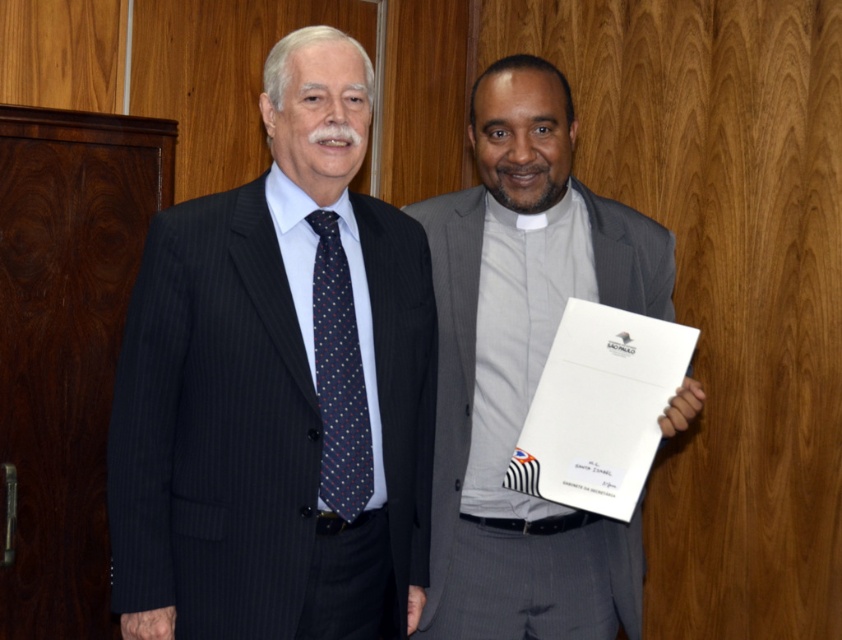
Question: From the image, what is the correct spatial relationship of gray matte suit at center in relation to dark blue silk tie at left?

Choices:
 (A) right
 (B) left

Answer: (A)

Question: Which object is positioned closest to the matte black suit at left?

Choices:
 (A) gray matte suit at center
 (B) dark blue silk tie at left

Answer: (B)

Question: Is matte black suit at left below gray matte suit at center?

Choices:
 (A) no
 (B) yes

Answer: (A)

Question: Can you confirm if matte black suit at left is smaller than dark blue silk tie at left?

Choices:
 (A) yes
 (B) no

Answer: (B)

Question: Which object is positioned closest to the matte black suit at left?

Choices:
 (A) dark blue silk tie at left
 (B) gray matte suit at center

Answer: (A)

Question: Which of the following is the farthest from the observer?

Choices:
 (A) gray matte suit at center
 (B) matte black suit at left
 (C) dark blue silk tie at left

Answer: (A)